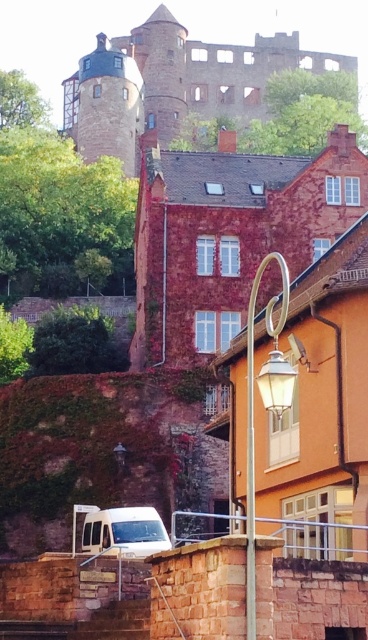
Who is positioned more to the left, metallic silver streetlight at center or white matte van at lower left?

white matte van at lower left is more to the left.

Can you confirm if metallic silver streetlight at center is wider than white matte van at lower left?

Correct, the width of metallic silver streetlight at center exceeds that of white matte van at lower left.

Does point (253, 454) come behind point (96, 512)?

That is False.

Image resolution: width=368 pixels, height=640 pixels. What are the coordinates of `metallic silver streetlight at center` in the screenshot? It's located at (263, 406).

Is the position of brown stone castle at upper center less distant than that of white matte van at lower left?

No, it is not.

I want to click on brown stone castle at upper center, so coord(172,84).

Find the location of `brown stone castle at upper center`. brown stone castle at upper center is located at coordinates (172, 84).

You are a GUI agent. You are given a task and a screenshot of the screen. Output one action in this format:
    pyautogui.click(x=<x>, y=<y>)
    Task: Click on the brown stone castle at upper center
    
    Given the screenshot: What is the action you would take?
    pyautogui.click(x=172, y=84)

Can you confirm if brown stone castle at upper center is positioned above metallic silver streetlight at center?

Indeed, brown stone castle at upper center is positioned over metallic silver streetlight at center.

Which is behind, point (146, 118) or point (277, 376)?

The point (146, 118) is more distant.

The height and width of the screenshot is (640, 368). I want to click on brown stone castle at upper center, so click(x=172, y=84).